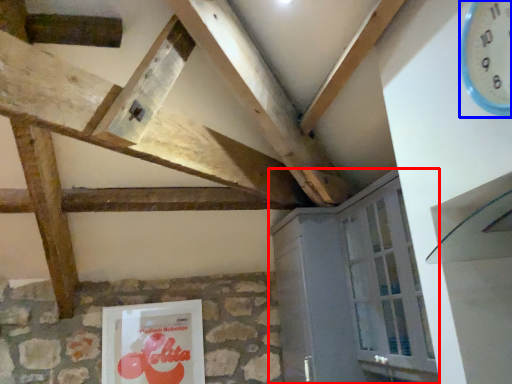
Question: Which object is further to the camera taking this photo, cabinetry (highlighted by a red box) or clock (highlighted by a blue box)?

Choices:
 (A) cabinetry
 (B) clock

Answer: (A)